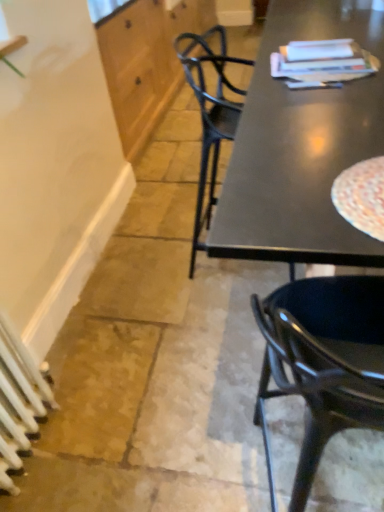
Question: Should I look upward or downward to see white wood cabinet at upper left?

Choices:
 (A) down
 (B) up

Answer: (B)

Question: Is white wood cabinet at upper left in contact with white metallic radiator at lower left?

Choices:
 (A) no
 (B) yes

Answer: (A)

Question: From a real-world perspective, is white wood cabinet at upper left below white metallic radiator at lower left?

Choices:
 (A) no
 (B) yes

Answer: (A)

Question: From a real-world perspective, is white wood cabinet at upper left on top of white metallic radiator at lower left?

Choices:
 (A) yes
 (B) no

Answer: (A)

Question: Can you confirm if white wood cabinet at upper left is bigger than white metallic radiator at lower left?

Choices:
 (A) yes
 (B) no

Answer: (A)

Question: Can you confirm if white wood cabinet at upper left is taller than white metallic radiator at lower left?

Choices:
 (A) yes
 (B) no

Answer: (A)

Question: Is white wood cabinet at upper left facing away from white metallic radiator at lower left?

Choices:
 (A) no
 (B) yes

Answer: (A)

Question: Considering the relative positions of white wood cabinet at upper left and glossy black chair at right in the image provided, is white wood cabinet at upper left to the left of glossy black chair at right from the viewer's perspective?

Choices:
 (A) no
 (B) yes

Answer: (B)

Question: Does white wood cabinet at upper left contain glossy black chair at right?

Choices:
 (A) no
 (B) yes

Answer: (A)

Question: Can you confirm if white wood cabinet at upper left is taller than glossy black chair at right?

Choices:
 (A) no
 (B) yes

Answer: (A)

Question: Is white wood cabinet at upper left turned away from glossy black chair at right?

Choices:
 (A) yes
 (B) no

Answer: (B)

Question: From a real-world perspective, is white wood cabinet at upper left physically above glossy black chair at right?

Choices:
 (A) yes
 (B) no

Answer: (B)

Question: From the image's perspective, is white wood cabinet at upper left above glossy black chair at right?

Choices:
 (A) yes
 (B) no

Answer: (A)

Question: From a real-world perspective, is white metallic radiator at lower left positioned over white wood cabinet at upper left based on gravity?

Choices:
 (A) yes
 (B) no

Answer: (B)